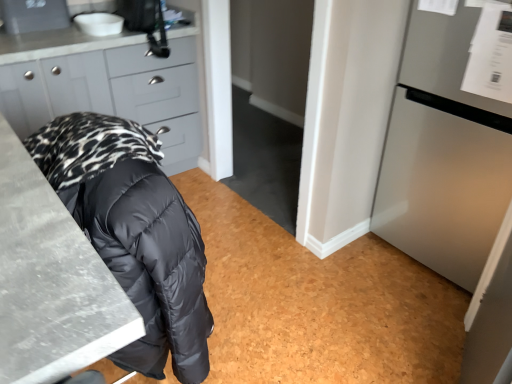
The height and width of the screenshot is (384, 512). Find the location of `free spot below white glossy sink at upper left (from a real-world perspective)`. free spot below white glossy sink at upper left (from a real-world perspective) is located at coordinates (94, 33).